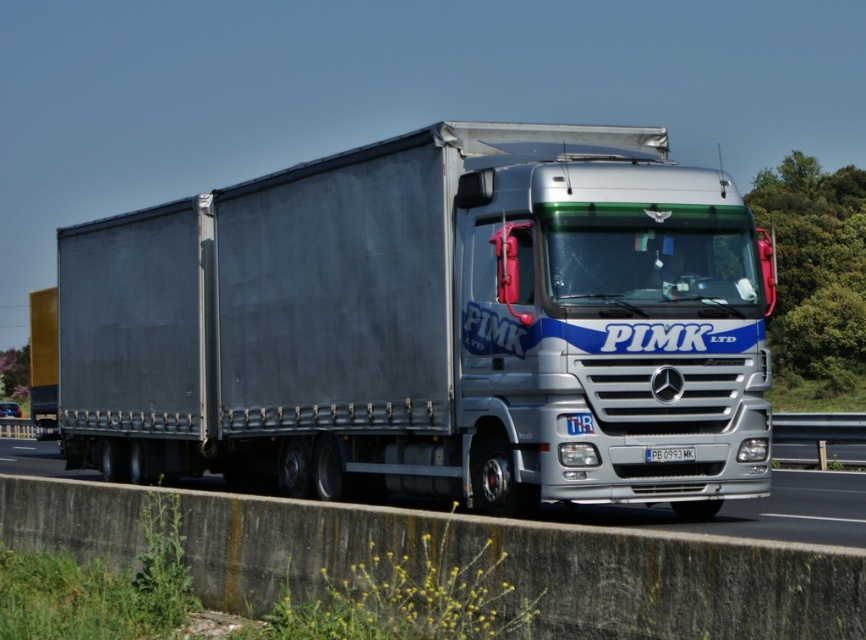
Question: Is silver metallic trailer truck at center to the left of blue plastic license plate at center from the viewer's perspective?

Choices:
 (A) no
 (B) yes

Answer: (B)

Question: Is silver metallic trailer truck at center to the left of blue plastic license plate at center from the viewer's perspective?

Choices:
 (A) no
 (B) yes

Answer: (B)

Question: Which of the following is the closest to the observer?

Choices:
 (A) (680, 456)
 (B) (134, 340)

Answer: (A)

Question: Can you confirm if silver metallic trailer truck at center is smaller than blue plastic license plate at center?

Choices:
 (A) yes
 (B) no

Answer: (B)